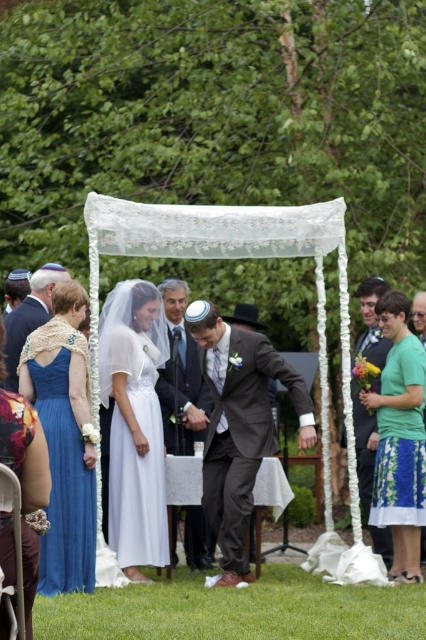
You are attending a wedding ceremony in a garden. You are standing at a position where the point marked as point (109, 371) is 37.11 feet away from you. If you want to move closer to this point, which direction should you move relative to your current position?

Since point (109, 371) is 37.11 feet away from you, moving forward towards it will reduce the distance. Therefore, you should move forward in the direction facing the point to get closer.

You are a photographer positioned at the origin point of the coordinate system. You need to capture a photo of the matte gray suit at center. What are the coordinates where you should aim your camera?

The coordinates to aim the camera are at point [181,376].